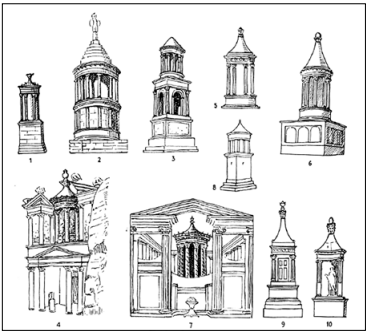
Locate an element on the screen. Image resolution: width=371 pixels, height=334 pixels. statue is located at coordinates (333, 279).